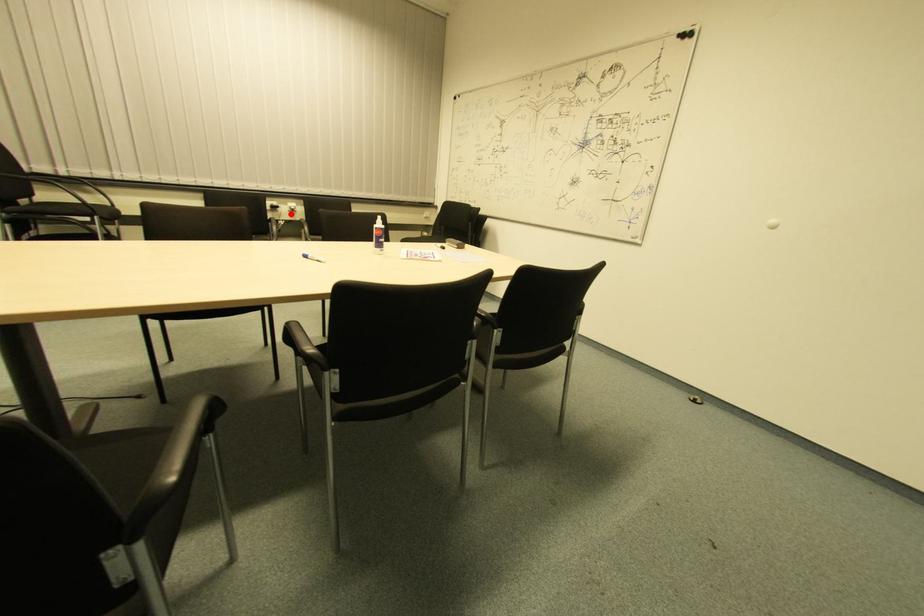
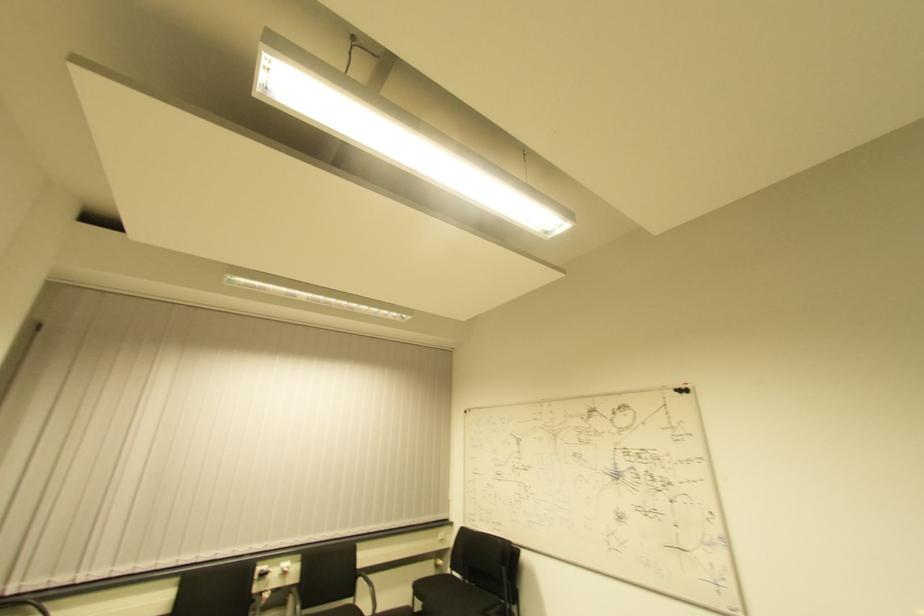
Find the pixel in the second image that matches the highlighted location in the first image.

(283, 576)